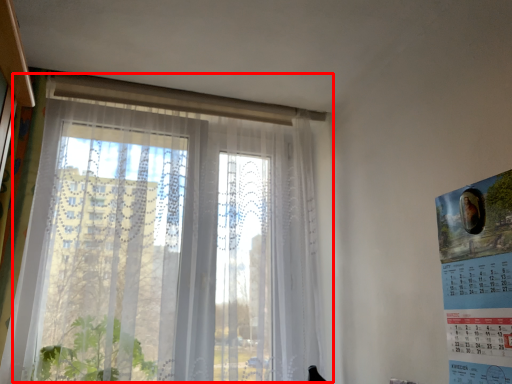
Question: Where is window (annotated by the red box) located in relation to poster page in the image?

Choices:
 (A) right
 (B) left

Answer: (B)